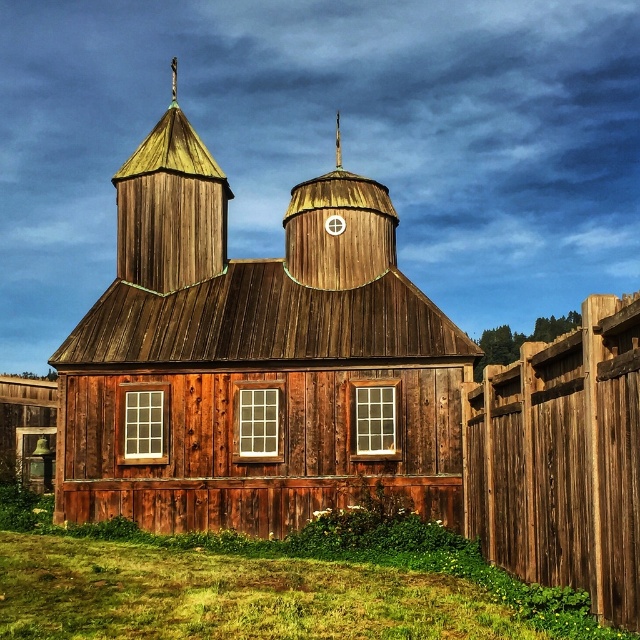
How much distance is there between wooden shingles spire at upper left and wooden spire at center?

wooden shingles spire at upper left is 52.72 feet from wooden spire at center.

Who is positioned more to the left, wooden shingles spire at upper left or wooden spire at center?

From the viewer's perspective, wooden shingles spire at upper left appears more on the left side.

Find the location of a particular element. The height and width of the screenshot is (640, 640). wooden shingles spire at upper left is located at coordinates (170, 205).

Is wooden shingles spire at upper left further to camera compared to gold textured spire at upper center?

That is False.

Is point (116, 172) closer to viewer compared to point (340, 154)?

No, it is behind (340, 154).

Does point (221, 248) come closer to viewer compared to point (336, 128)?

That is True.

The height and width of the screenshot is (640, 640). What are the coordinates of `wooden shingles spire at upper left` in the screenshot? It's located at (170, 205).

Which is behind, point (532, 509) or point (337, 166)?

Point (337, 166)

Locate an element on the screen. Image resolution: width=640 pixels, height=640 pixels. brown wooden fence at right is located at coordinates (563, 460).